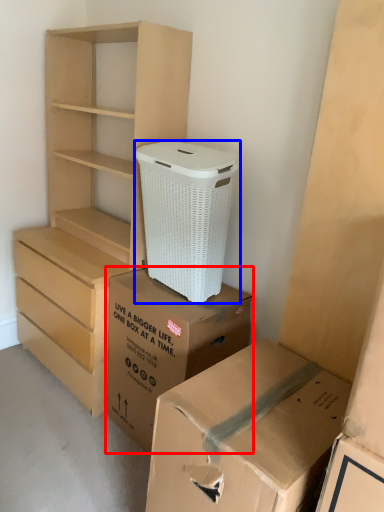
Question: Which of the following is the farthest to the observer, box (highlighted by a red box) or shoe box (highlighted by a blue box)?

Choices:
 (A) box
 (B) shoe box

Answer: (A)